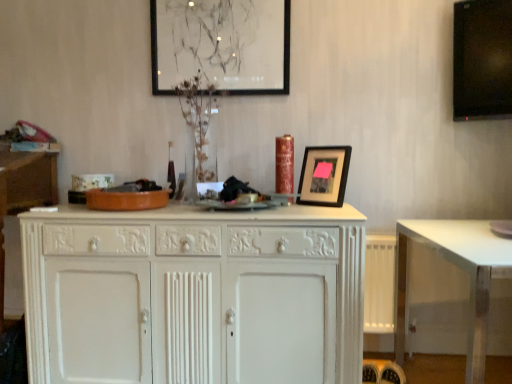
Question: From a real-world perspective, is clear glass vase at center beneath white painted wood cabinet at center?

Choices:
 (A) no
 (B) yes

Answer: (A)

Question: Is white painted wood cabinet at center located within clear glass vase at center?

Choices:
 (A) no
 (B) yes

Answer: (A)

Question: Is clear glass vase at center completely or partially outside of white painted wood cabinet at center?

Choices:
 (A) yes
 (B) no

Answer: (A)

Question: From the image's perspective, is clear glass vase at center above white painted wood cabinet at center?

Choices:
 (A) no
 (B) yes

Answer: (B)

Question: Is clear glass vase at center further to camera compared to white painted wood cabinet at center?

Choices:
 (A) yes
 (B) no

Answer: (A)

Question: Relative to white glossy table at lower right, is white wood cabinet at left in front or behind?

Choices:
 (A) behind
 (B) front

Answer: (A)

Question: Is point (12, 203) closer or farther from the camera than point (396, 276)?

Choices:
 (A) farther
 (B) closer

Answer: (B)

Question: In terms of height, does white wood cabinet at left look taller or shorter compared to white glossy table at lower right?

Choices:
 (A) tall
 (B) short

Answer: (A)

Question: Is white wood cabinet at left inside or outside of white glossy table at lower right?

Choices:
 (A) inside
 (B) outside

Answer: (B)

Question: Is white glossy table at lower right bigger or smaller than white wood cabinet at left?

Choices:
 (A) big
 (B) small

Answer: (A)

Question: In terms of width, does white glossy table at lower right look wider or thinner when compared to white wood cabinet at left?

Choices:
 (A) wide
 (B) thin

Answer: (A)

Question: Is point (497, 238) positioned closer to the camera than point (51, 190)?

Choices:
 (A) closer
 (B) farther

Answer: (A)

Question: From the image's perspective, relative to white wood cabinet at left, is white glossy table at lower right above or below?

Choices:
 (A) above
 (B) below

Answer: (B)

Question: From the image's perspective, relative to black matte picture frame at upper center, acting as the first picture frame starting from the right, is black glossy monitor at upper right above or below?

Choices:
 (A) below
 (B) above

Answer: (B)

Question: Looking at their shapes, would you say black glossy monitor at upper right is wider or thinner than black matte picture frame at upper center, the second picture frame in the top-to-bottom sequence?

Choices:
 (A) wide
 (B) thin

Answer: (B)